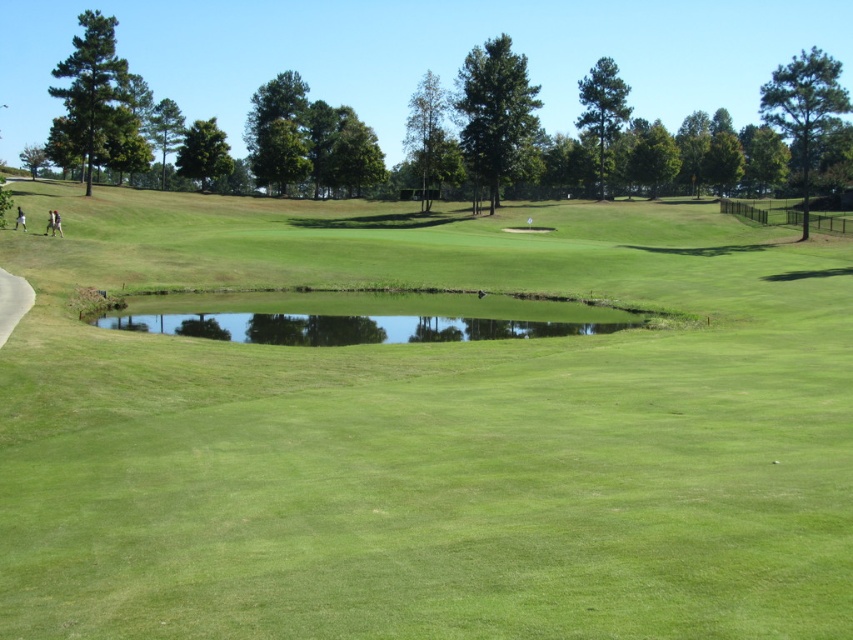
Which is behind, point (22, 496) or point (241, 316)?

Point (241, 316)

Is point (402, 605) positioned before point (579, 321)?

Yes, point (402, 605) is in front of point (579, 321).

Between point (843, 288) and point (428, 340), which one is positioned behind?

Positioned behind is point (843, 288).

The height and width of the screenshot is (640, 853). I want to click on green grassy field at center, so click(x=428, y=433).